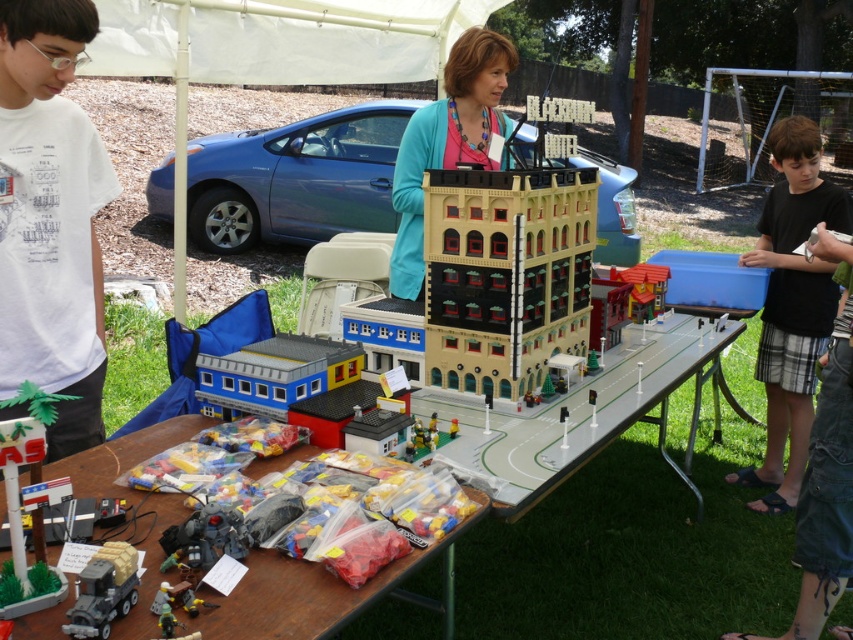
Who is shorter, black plaid shorts at lower right or matte teal sweater at center?

matte teal sweater at center is shorter.

Is point (828, 323) farther from viewer compared to point (477, 161)?

Yes, it is.

You are a GUI agent. You are given a task and a screenshot of the screen. Output one action in this format:
    pyautogui.click(x=<x>, y=<y>)
    Task: Click on the black plaid shorts at lower right
    
    Given the screenshot: What is the action you would take?
    pyautogui.click(x=791, y=305)

Does black plaid shorts at lower right appear on the right side of shiny metallic robot at lower left?

Yes, black plaid shorts at lower right is to the right of shiny metallic robot at lower left.

Locate an element on the screen. This screenshot has width=853, height=640. black plaid shorts at lower right is located at coordinates (791, 305).

Can you confirm if matte teal sweater at center is positioned above brick-red plastic building at center?

Correct, matte teal sweater at center is located above brick-red plastic building at center.

Describe the element at coordinates (447, 141) in the screenshot. I see `matte teal sweater at center` at that location.

At what (x,y) coordinates should I click in order to perform the action: click on matte teal sweater at center. Please return your answer as a coordinate pair (x, y). Looking at the image, I should click on (447, 141).